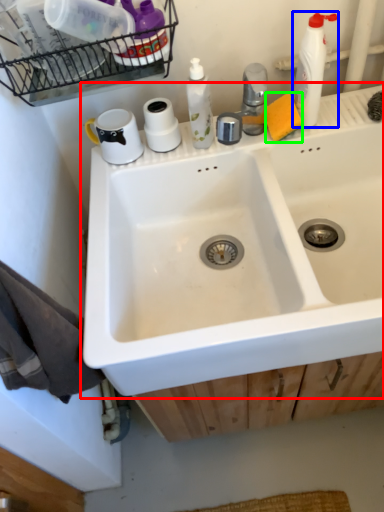
Question: Based on their relative distances, which object is nearer to sink (highlighted by a red box)? Choose from cleaning product (highlighted by a blue box) and soap (highlighted by a green box).

Choices:
 (A) cleaning product
 (B) soap

Answer: (B)